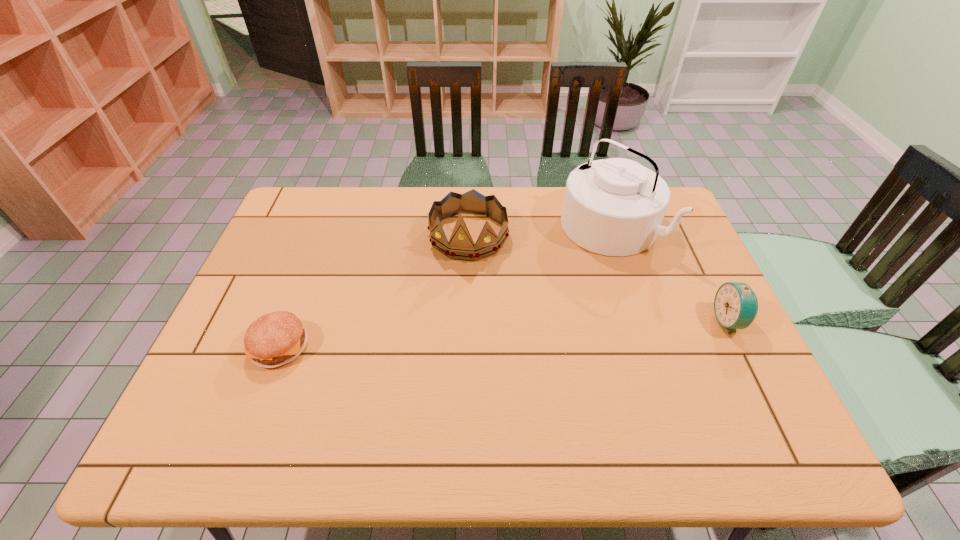
Find the location of `the shortest object`. the shortest object is located at coordinates (274, 339).

Locate an element on the screen. The height and width of the screenshot is (540, 960). the leftmost object is located at coordinates (274, 339).

At what (x,y) coordinates should I click in order to perform the action: click on alarm clock. Please return your answer as a coordinate pair (x, y). This screenshot has width=960, height=540. Looking at the image, I should click on (735, 305).

Locate an element on the screen. The image size is (960, 540). the third tallest object is located at coordinates (735, 305).

At what (x,y) coordinates should I click in order to perform the action: click on the tallest object. Please return your answer as a coordinate pair (x, y). This screenshot has width=960, height=540. Looking at the image, I should click on (615, 207).

This screenshot has height=540, width=960. Identify the location of kettle. (615, 207).

Image resolution: width=960 pixels, height=540 pixels. In order to click on the third shortest object in this screenshot , I will do `click(461, 246)`.

Where is `the third object from right to left`? The height and width of the screenshot is (540, 960). the third object from right to left is located at coordinates (461, 246).

The image size is (960, 540). Identify the location of free region located on the back of the shortest object. (312, 262).

Image resolution: width=960 pixels, height=540 pixels. What are the coordinates of `free space located 0.230m on the front-facing side of the rightmost object` in the screenshot? It's located at (627, 321).